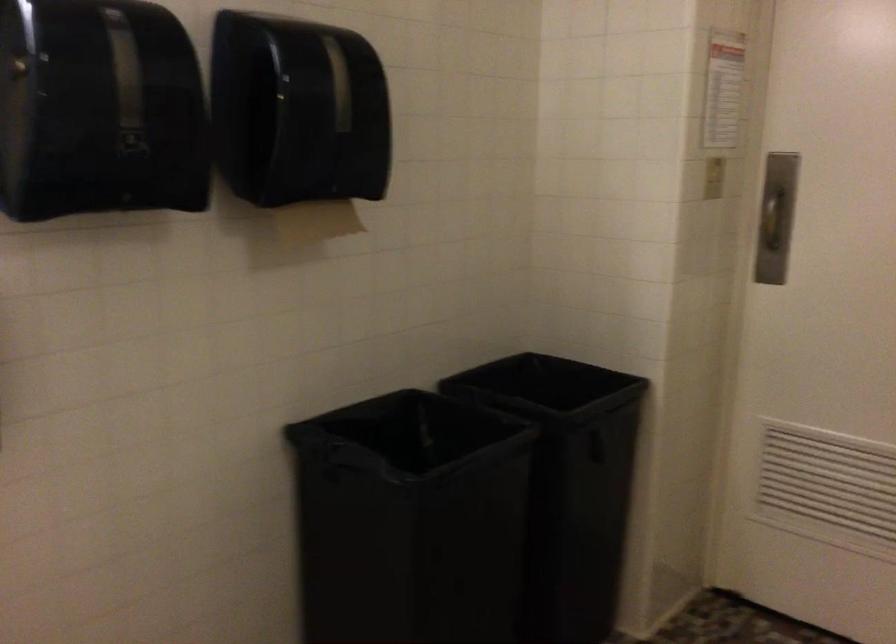
Describe the element at coordinates (776, 216) in the screenshot. I see `a metal door handle` at that location.